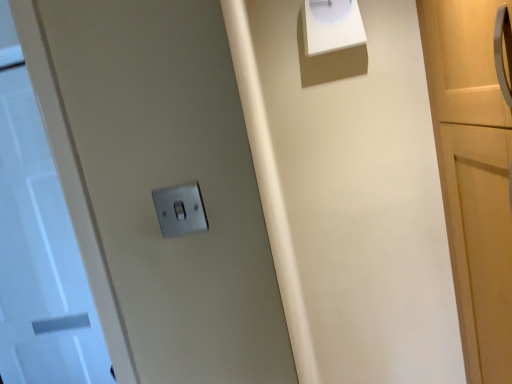
Locate an element on the screen. The width and height of the screenshot is (512, 384). white glossy clock at upper center is located at coordinates (331, 26).

The image size is (512, 384). What are the coordinates of `metallic silver light switch at center` in the screenshot? It's located at (180, 210).

Can you confirm if white glossy door at left is taller than metallic silver light switch at center?

Indeed, white glossy door at left has a greater height compared to metallic silver light switch at center.

Considering the relative positions of white glossy door at left and metallic silver light switch at center in the image provided, is white glossy door at left to the right of metallic silver light switch at center from the viewer's perspective?

Incorrect, white glossy door at left is not on the right side of metallic silver light switch at center.

Where is `door that is under the metallic silver light switch at center (from a real-world perspective)`? door that is under the metallic silver light switch at center (from a real-world perspective) is located at coordinates (41, 244).

Who is more distant, metallic silver light switch at center or white glossy door at left?

white glossy door at left is further from the camera.

From the image's perspective, is metallic silver light switch at center located beneath white glossy door at left?

No.

How many degrees apart are the facing directions of metallic silver light switch at center and white glossy door at left?

1.56 degrees separate the facing orientations of metallic silver light switch at center and white glossy door at left.

Looking at the image, does metallic silver light switch at center seem bigger or smaller compared to white glossy door at left?

Considering their sizes, metallic silver light switch at center takes up less space than white glossy door at left.

Does white glossy clock at upper center lie behind metallic silver light switch at center?

Yes, white glossy clock at upper center is further from the viewer.

Is white glossy clock at upper center not near metallic silver light switch at center?

That's right, there is a large distance between white glossy clock at upper center and metallic silver light switch at center.

Can you confirm if white glossy clock at upper center is positioned to the right of metallic silver light switch at center?

Indeed, white glossy clock at upper center is positioned on the right side of metallic silver light switch at center.

Does white glossy clock at upper center contain metallic silver light switch at center?

No, metallic silver light switch at center is not inside white glossy clock at upper center.

How many degrees apart are the facing directions of white glossy door at left and white glossy clock at upper center?

The angular difference between white glossy door at left and white glossy clock at upper center is 0.134 degrees.

From the image's perspective, is white glossy door at left beneath white glossy clock at upper center?

Yes, from the image's perspective, white glossy door at left is below white glossy clock at upper center.

From a real-world perspective, does white glossy door at left sit lower than white glossy clock at upper center?

Correct, in the physical world, white glossy door at left is lower than white glossy clock at upper center.

In the scene shown: Are metallic silver light switch at center and white glossy clock at upper center far apart?

Yes.

Is metallic silver light switch at center looking in the opposite direction of white glossy clock at upper center?

No, metallic silver light switch at center is not facing away from white glossy clock at upper center.

Can you tell me how much metallic silver light switch at center and white glossy clock at upper center differ in facing direction?

There is a 1.7-degree angle between the facing directions of metallic silver light switch at center and white glossy clock at upper center.

Considering the relative sizes of metallic silver light switch at center and white glossy clock at upper center in the image provided, is metallic silver light switch at center smaller than white glossy clock at upper center?

Indeed, metallic silver light switch at center has a smaller size compared to white glossy clock at upper center.

In the scene shown: Considering the sizes of white glossy clock at upper center and white glossy door at left in the image, is white glossy clock at upper center bigger or smaller than white glossy door at left?

Clearly, white glossy clock at upper center is smaller in size than white glossy door at left.

Looking at this image, considering the sizes of objects white glossy clock at upper center and white glossy door at left in the image provided, who is shorter, white glossy clock at upper center or white glossy door at left?

Standing shorter between the two is white glossy clock at upper center.

From the image's perspective, which is below, white glossy clock at upper center or white glossy door at left?

From the image's view, white glossy door at left is below.

Are white glossy clock at upper center and white glossy door at left making contact?

No.

I want to click on door located on the left of metallic silver light switch at center, so click(x=41, y=244).

You are a GUI agent. You are given a task and a screenshot of the screen. Output one action in this format:
    pyautogui.click(x=<x>, y=<y>)
    Task: Click on the door behind the metallic silver light switch at center
    
    Given the screenshot: What is the action you would take?
    pyautogui.click(x=41, y=244)

Based on their spatial positions, is white glossy door at left or metallic silver light switch at center further from white glossy clock at upper center?

The object further to white glossy clock at upper center is white glossy door at left.

From the image, which object appears to be farther from metallic silver light switch at center, white glossy door at left or white glossy clock at upper center?

Based on the image, white glossy door at left appears to be further to metallic silver light switch at center.

Which object lies further to the anchor point white glossy door at left, white glossy clock at upper center or metallic silver light switch at center?

metallic silver light switch at center lies further to white glossy door at left than the other object.

Looking at the image, which one is located closer to white glossy clock at upper center, metallic silver light switch at center or white glossy door at left?

Among the two, metallic silver light switch at center is located nearer to white glossy clock at upper center.

Based on the photo, considering their positions, is white glossy clock at upper center positioned further to metallic silver light switch at center than white glossy door at left?

Based on the image, white glossy door at left appears to be further to metallic silver light switch at center.

Which object lies further to the anchor point white glossy door at left, metallic silver light switch at center or white glossy clock at upper center?

Based on the image, metallic silver light switch at center appears to be further to white glossy door at left.

Find the location of `light switch between white glossy door at left and white glossy clock at upper center`. light switch between white glossy door at left and white glossy clock at upper center is located at coordinates click(x=180, y=210).